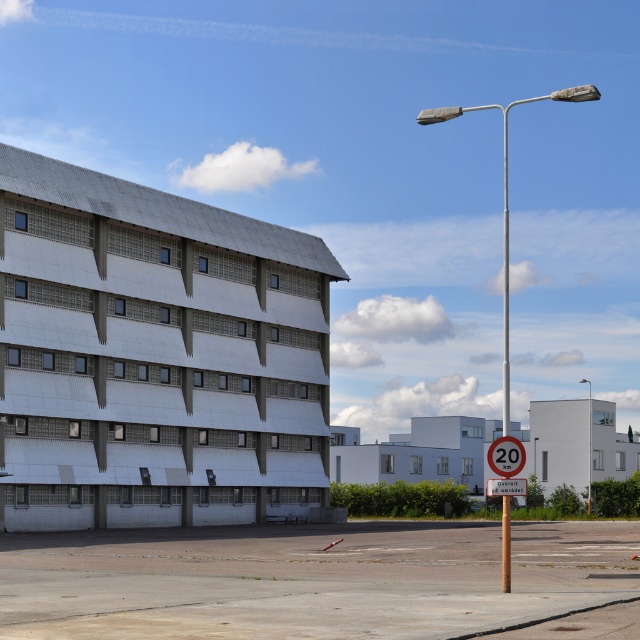
Question: Which of the following is the farthest from the observer?

Choices:
 (A) red plastic speed limit sign at center
 (B) metallic pole at upper right
 (C) metallic pole at right

Answer: (B)

Question: Which object is farther from the camera taking this photo?

Choices:
 (A) metallic gray pole at right
 (B) metallic pole at right
 (C) red plastic speed limit sign at center
 (D) metallic pole at upper right

Answer: (D)

Question: Does metallic gray pole at right lie behind white plastic sign at upper center?

Choices:
 (A) no
 (B) yes

Answer: (B)

Question: Which point is farther to the camera?

Choices:
 (A) red plastic speed limit sign at center
 (B) metallic pole at upper right
 (C) white plastic sign at upper center

Answer: (B)

Question: Where is red plastic speed limit sign at center located in relation to metallic pole at upper right in the image?

Choices:
 (A) right
 (B) left

Answer: (B)

Question: Can you confirm if metallic gray pole at right is bigger than red plastic speed limit sign at center?

Choices:
 (A) yes
 (B) no

Answer: (A)